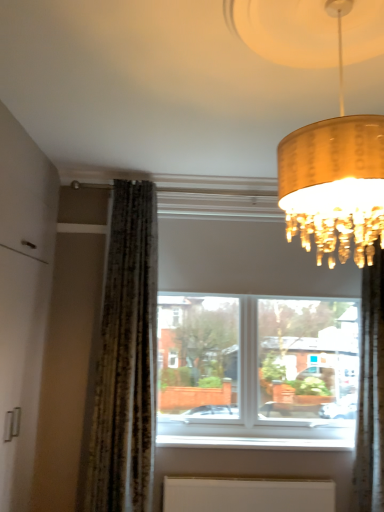
Find the location of `transparent glass window at center`. transparent glass window at center is located at coordinates (252, 338).

The width and height of the screenshot is (384, 512). Describe the element at coordinates (335, 178) in the screenshot. I see `gold textured lampshade at upper right` at that location.

Where is `silky green curtain at right`? The width and height of the screenshot is (384, 512). silky green curtain at right is located at coordinates (370, 393).

Looking at this image, is silky green curtain at right wider or thinner than gold textured lampshade at upper right?

In the image, silky green curtain at right appears to be more narrow than gold textured lampshade at upper right.

Does silky green curtain at right have a larger size compared to gold textured lampshade at upper right?

Incorrect, silky green curtain at right is not larger than gold textured lampshade at upper right.

Would you say silky green curtain at right is a long distance from gold textured lampshade at upper right?

silky green curtain at right is far away from gold textured lampshade at upper right.

From a real-world perspective, between silky green curtain at right and gold textured lampshade at upper right, who is vertically higher?

From a 3D spatial view, gold textured lampshade at upper right is above.

Image resolution: width=384 pixels, height=512 pixels. I want to click on window located in front of the white smooth window sill at lower center, so click(252, 338).

From the picture: Can you confirm if white smooth window sill at lower center is bigger than transparent glass window at center?

No, white smooth window sill at lower center is not bigger than transparent glass window at center.

Considering the sizes of objects white smooth window sill at lower center and transparent glass window at center in the image provided, who is taller, white smooth window sill at lower center or transparent glass window at center?

With more height is transparent glass window at center.

Considering the sizes of objects gold textured lampshade at upper right and silky green curtain at right in the image provided, who is taller, gold textured lampshade at upper right or silky green curtain at right?

silky green curtain at right.

I want to click on lamp that appears above the silky green curtain at right (from a real-world perspective), so click(335, 178).

From the image's perspective, who appears lower, gold textured lampshade at upper right or silky green curtain at right?

silky green curtain at right appears lower in the image.

Is gold textured lampshade at upper right in front of or behind silky green curtain at right in the image?

gold textured lampshade at upper right is positioned closer to the viewer than silky green curtain at right.

From the image's perspective, is transparent glass window at center beneath gold textured lampshade at upper right?

Indeed, from the image's perspective, transparent glass window at center is shown beneath gold textured lampshade at upper right.

From a real-world perspective, between transparent glass window at center and gold textured lampshade at upper right, who is vertically lower?

From a 3D spatial view, transparent glass window at center is below.

Is transparent glass window at center wider than gold textured lampshade at upper right?

Incorrect, the width of transparent glass window at center does not surpass that of gold textured lampshade at upper right.

Which object is further away from the camera, transparent glass window at center or gold textured lampshade at upper right?

transparent glass window at center is further from the camera.

Does silky green curtain at right touch transparent glass window at center?

silky green curtain at right and transparent glass window at center are not in contact.

Considering the relative sizes of silky green curtain at right and transparent glass window at center in the image provided, is silky green curtain at right smaller than transparent glass window at center?

Indeed, silky green curtain at right has a smaller size compared to transparent glass window at center.

Between silky green curtain at right and transparent glass window at center, which one has smaller width?

transparent glass window at center.

From the image's perspective, is gold textured lampshade at upper right above or below white smooth window sill at lower center?

From the image's perspective, gold textured lampshade at upper right appears above white smooth window sill at lower center.

Can you tell me how much gold textured lampshade at upper right and white smooth window sill at lower center differ in facing direction?

The angle between the facing direction of gold textured lampshade at upper right and the facing direction of white smooth window sill at lower center is 90 degrees.

Which is more to the right, gold textured lampshade at upper right or white smooth window sill at lower center?

Positioned to the right is white smooth window sill at lower center.

Considering the positions of points (290, 137) and (337, 444), is point (290, 137) farther from camera compared to point (337, 444)?

No, it is in front of (337, 444).

Based on the photo, does white matte radiator at lower center appear on the right side of silky green curtain at right?

Incorrect, white matte radiator at lower center is not on the right side of silky green curtain at right.

From the image's perspective, which is below, white matte radiator at lower center or silky green curtain at right?

white matte radiator at lower center appears lower in the image.

Which of these two, white matte radiator at lower center or silky green curtain at right, is wider?

Wider between the two is silky green curtain at right.

Could you tell me if white matte radiator at lower center is facing silky green curtain at right?

No, white matte radiator at lower center is not turned towards silky green curtain at right.

Image resolution: width=384 pixels, height=512 pixels. There is a silky green curtain at right. What are the coordinates of `lamp above it (from a real-world perspective)` in the screenshot? It's located at (335, 178).

Where is `window that appears on the right of white smooth window sill at lower center`? window that appears on the right of white smooth window sill at lower center is located at coordinates (252, 338).

Looking at this image, considering their positions, is gold textured lampshade at upper right positioned further to silky green curtain at right than white matte radiator at lower center?

The object further to silky green curtain at right is gold textured lampshade at upper right.

Looking at the image, which one is located further to silky green curtain at right, gold textured lampshade at upper right or white smooth window sill at lower center?

gold textured lampshade at upper right lies further to silky green curtain at right than the other object.

When comparing their distances from gold textured lampshade at upper right, does transparent glass window at center or white matte radiator at lower center seem further?

white matte radiator at lower center lies further to gold textured lampshade at upper right than the other object.

Estimate the real-world distances between objects in this image. Which object is further from white smooth window sill at lower center, silky green curtain at right or gold textured lampshade at upper right?

gold textured lampshade at upper right is positioned further to the anchor white smooth window sill at lower center.

Considering their positions, is white smooth window sill at lower center positioned further to silky green curtain at right than white matte radiator at lower center?

white matte radiator at lower center is positioned further to the anchor silky green curtain at right.

Consider the image. Considering their positions, is white smooth window sill at lower center positioned further to white matte radiator at lower center than silky green curtain at right?

Among the two, silky green curtain at right is located further to white matte radiator at lower center.

When comparing their distances from gold textured lampshade at upper right, does white smooth window sill at lower center or transparent glass window at center seem closer?

transparent glass window at center is positioned closer to the anchor gold textured lampshade at upper right.

Which object lies further to the anchor point white matte radiator at lower center, silky green curtain at right or gold textured lampshade at upper right?

gold textured lampshade at upper right lies further to white matte radiator at lower center than the other object.

Where is `radiator between gold textured lampshade at upper right and transparent glass window at center along the z-axis`? This screenshot has width=384, height=512. radiator between gold textured lampshade at upper right and transparent glass window at center along the z-axis is located at coordinates (247, 494).

Find the location of `window sill between transparent glass window at center and white matte radiator at lower center vertically`. window sill between transparent glass window at center and white matte radiator at lower center vertically is located at coordinates (254, 442).

The height and width of the screenshot is (512, 384). What are the coordinates of `radiator between gold textured lampshade at upper right and white smooth window sill at lower center along the z-axis` in the screenshot? It's located at 247,494.

Where is `curtain between gold textured lampshade at upper right and white smooth window sill at lower center along the z-axis`? The height and width of the screenshot is (512, 384). curtain between gold textured lampshade at upper right and white smooth window sill at lower center along the z-axis is located at coordinates (370, 393).